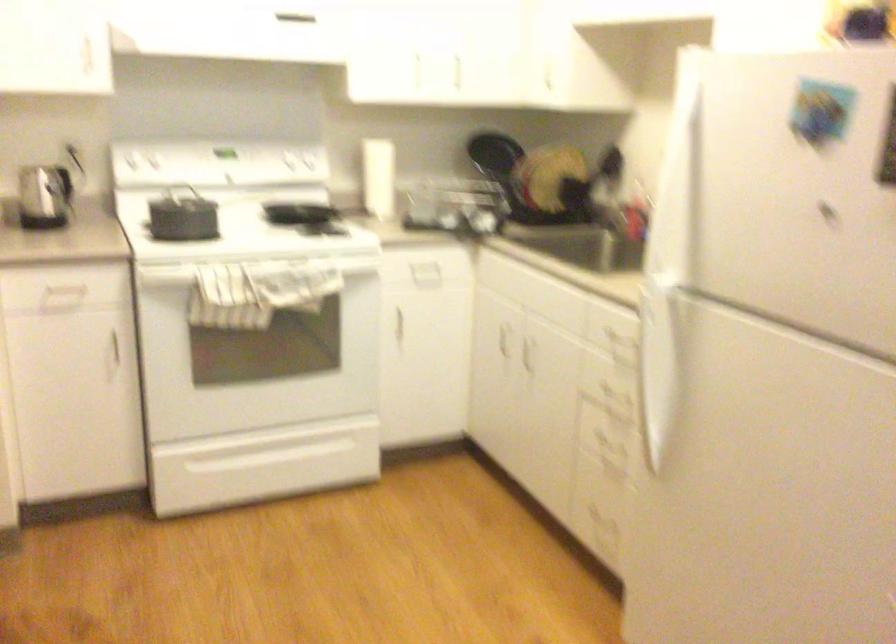
You are a GUI agent. You are given a task and a screenshot of the screen. Output one action in this format:
    pyautogui.click(x=<x>, y=<y>)
    Task: Click on the white paper towel roll
    The width and height of the screenshot is (896, 644).
    Given the screenshot: What is the action you would take?
    pyautogui.click(x=377, y=178)